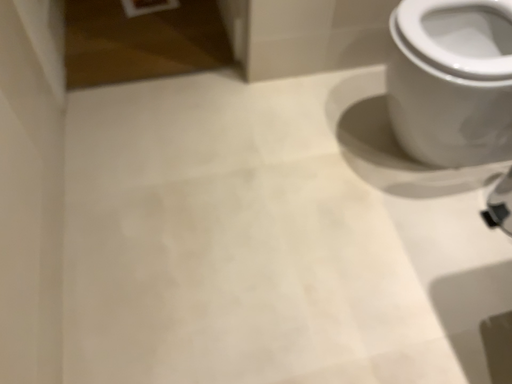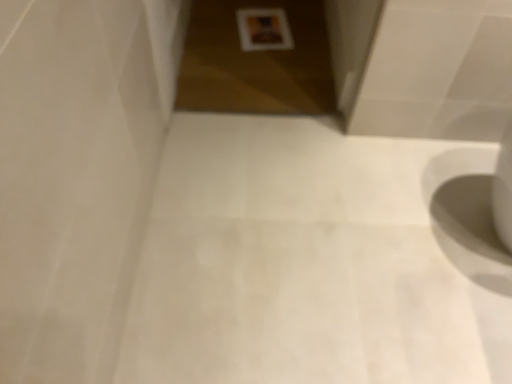
Question: Which way did the camera rotate in the video?

Choices:
 (A) rotated right
 (B) rotated left

Answer: (B)